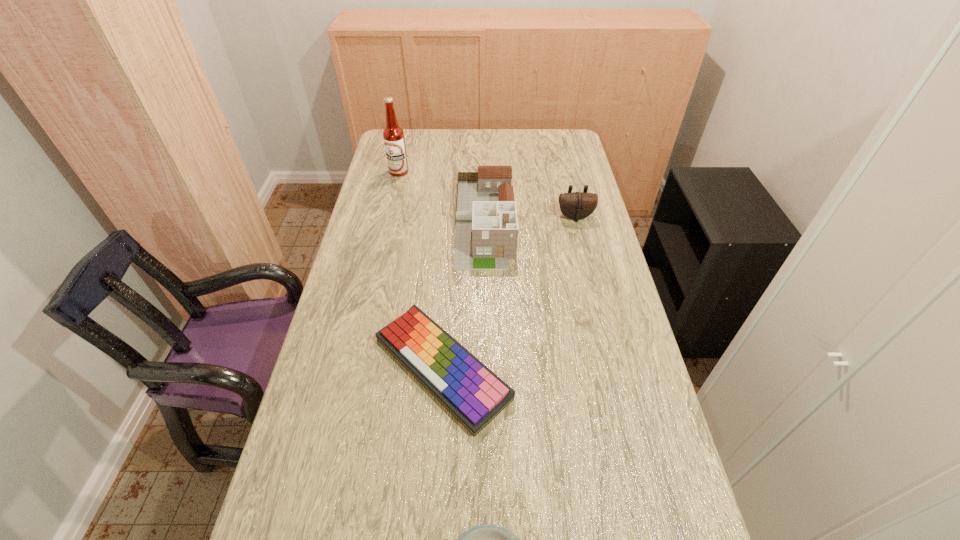
At what (x,y) coordinates should I click in order to perform the action: click on vacant space located on the right of the shortest object. Please return your answer as a coordinate pair (x, y). Looking at the image, I should click on (630, 368).

At what (x,y) coordinates should I click in order to perform the action: click on alcohol located at the left edge. Please return your answer as a coordinate pair (x, y). The width and height of the screenshot is (960, 540). Looking at the image, I should click on (393, 135).

This screenshot has height=540, width=960. Identify the location of computer keyboard present at the left edge. (470, 391).

Find the location of a particular element. object at the right edge is located at coordinates (574, 205).

At what (x,y) coordinates should I click in order to perform the action: click on free space at the far edge of the desktop. Please return your answer as a coordinate pair (x, y). This screenshot has height=540, width=960. Looking at the image, I should click on (482, 152).

At what (x,y) coordinates should I click in order to perform the action: click on vacant space at the left edge. Please return your answer as a coordinate pair (x, y). Looking at the image, I should click on (357, 321).

I want to click on free region at the right edge, so coord(574,262).

What are the coordinates of `vacant space at the far left corner` in the screenshot? It's located at (415, 140).

What are the coordinates of `vacant point at the far right corner` in the screenshot? It's located at pyautogui.click(x=544, y=153).

The image size is (960, 540). Find the location of `free space between the shortest object and the rightmost object`. free space between the shortest object and the rightmost object is located at coordinates (509, 292).